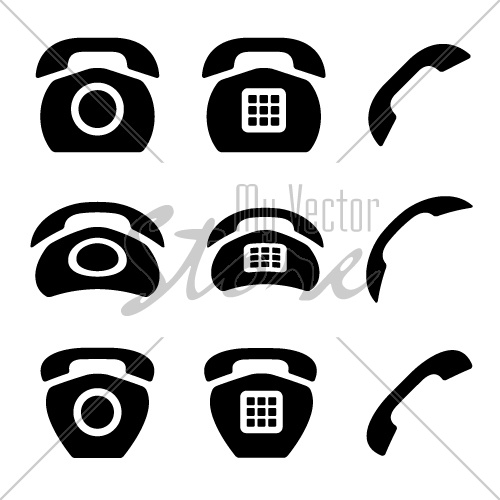
The height and width of the screenshot is (500, 500). Identify the location of bottom of telephones with circle dials. (124, 125), (128, 266), (118, 408).